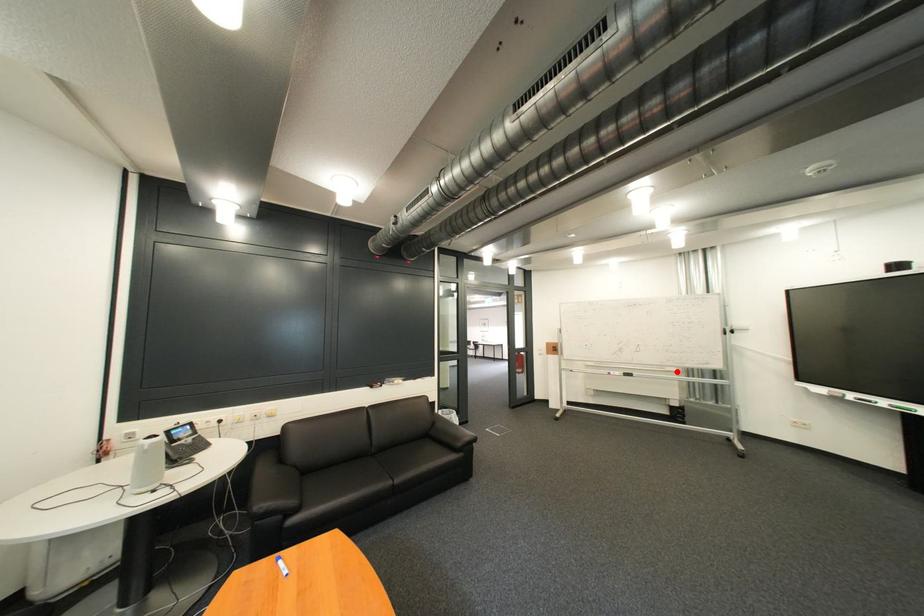
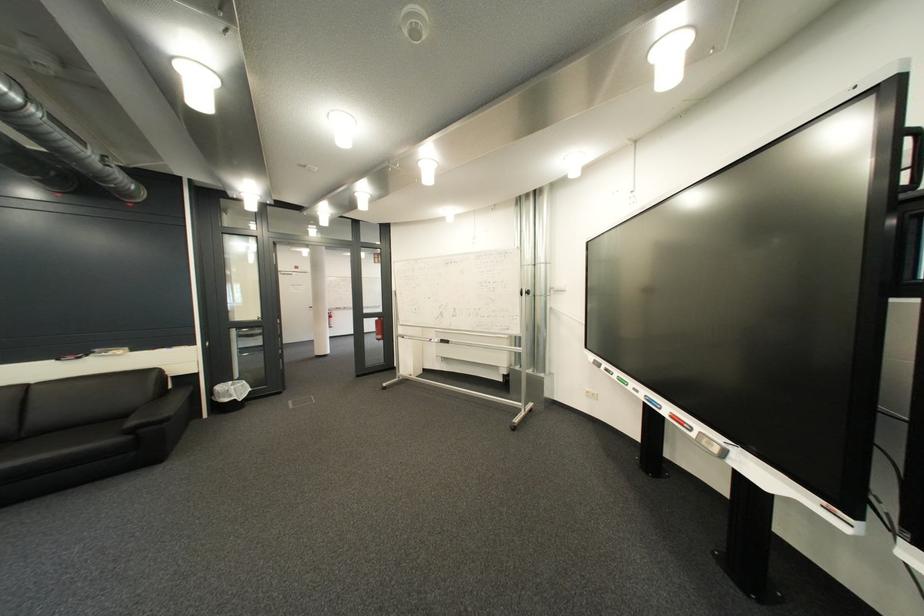
Where in the second image is the point corresponding to the highlighted location from the first image?

(509, 338)